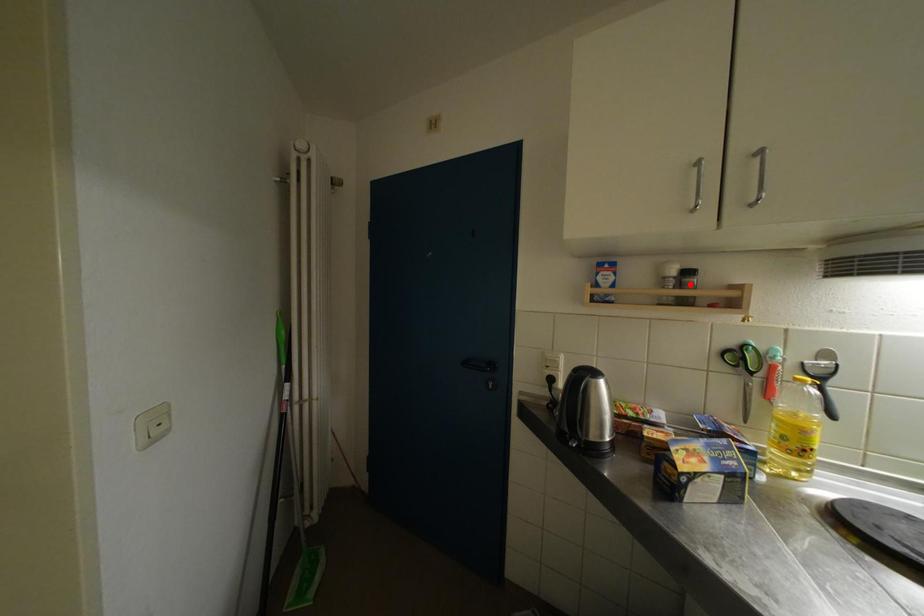
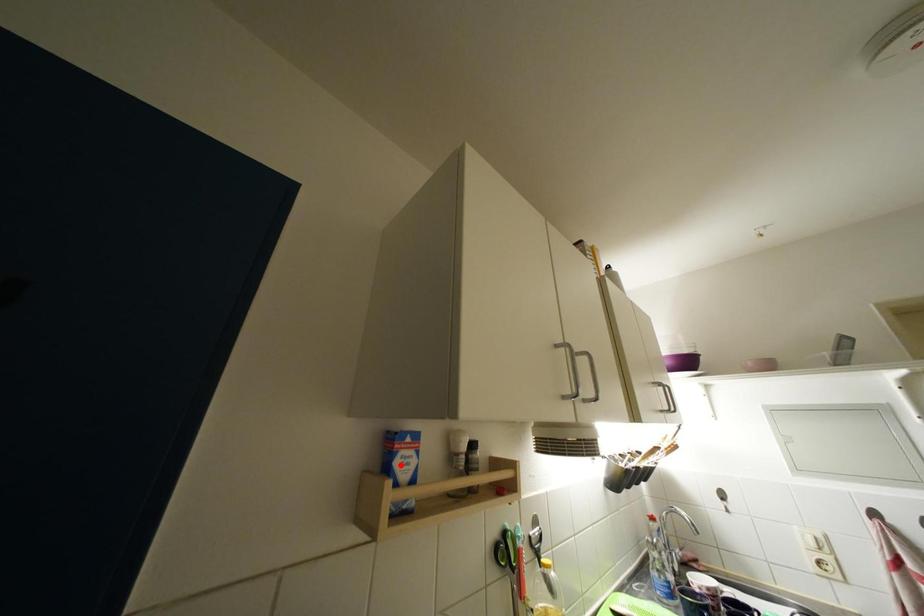
I am providing you with two images of the same scene from different viewpoints. A red point is marked on the first image and another point is marked on the second image. Do the highlighted points in image1 and image2 indicate the same real-world spot?

No